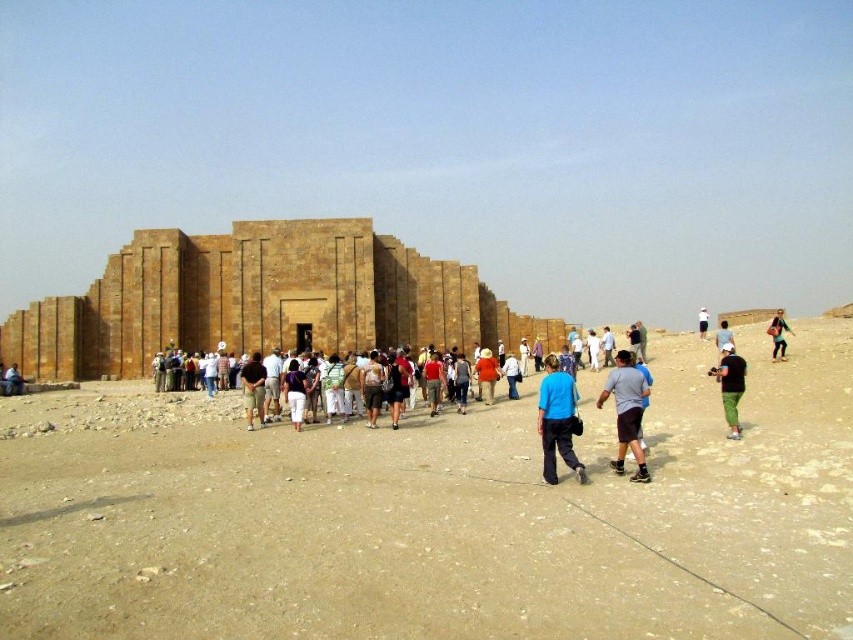
Consider the image. Does matte orange shirt at center appear on the left side of white fabric hat at center?

Indeed, matte orange shirt at center is positioned on the left side of white fabric hat at center.

Between matte orange shirt at center and white fabric hat at center, which one is positioned higher?

white fabric hat at center is higher up.

The image size is (853, 640). Identify the location of matte orange shirt at center. click(486, 374).

Where is `matte orange shirt at center`? Image resolution: width=853 pixels, height=640 pixels. matte orange shirt at center is located at coordinates (486, 374).

Which is in front, point (740, 429) or point (721, 332)?

Positioned in front is point (740, 429).

In order to click on black cotton shirt at center in this screenshot , I will do `click(730, 385)`.

Can you confirm if blue fabric pants at center is smaller than dark brown leather pants at center?

Incorrect, blue fabric pants at center is not smaller in size than dark brown leather pants at center.

Does blue fabric pants at center have a lesser height compared to dark brown leather pants at center?

No, blue fabric pants at center is not shorter than dark brown leather pants at center.

Between point (575, 410) and point (247, 419), which one is positioned in front?

Point (575, 410) is more forward.

Image resolution: width=853 pixels, height=640 pixels. I want to click on blue fabric pants at center, so click(x=556, y=420).